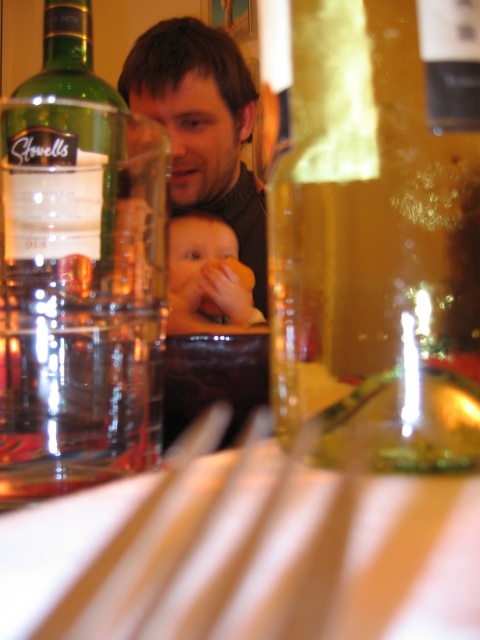
You are a fashion designer looking for a matte black sweater at center in an image. According to the coordinates provided, where should you look to find it?

The matte black sweater at center is located at point coordinates (203, 125).

You are a bartender who needs to place a new drink order. You see the green glass bottle at upper left and the matte black sweater at center. Which object is located to the right of the other?

The green glass bottle at upper left is positioned on the right side of matte black sweater at center, so the green glass bottle at upper left is to the right of the matte black sweater at center.

You are a photographer trying to capture a closeup of the matte black sweater at center and the smooth skin baby at center. Since you want to focus on both subjects equally, which one should you adjust your camera to prioritize in terms of size to ensure they appear balanced in the frame?

The matte black sweater at center is wider than the smooth skin baby at center. To balance them in the frame, you should make the matte black sweater at center smaller or move it further away so that it matches the size of the smooth skin baby at center.